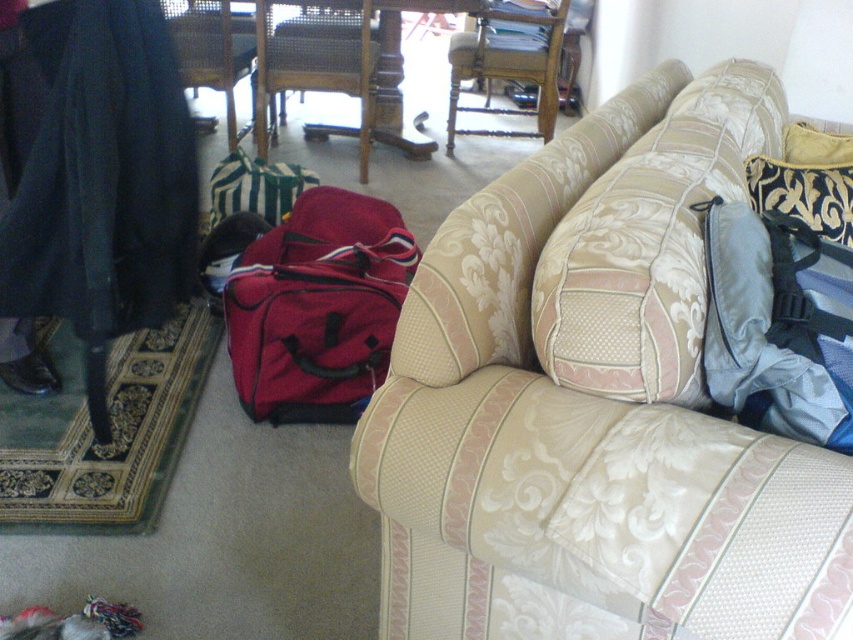
Question: Which point appears farthest from the camera in this image?

Choices:
 (A) coord(831,150)
 (B) coord(840,275)
 (C) coord(267,179)

Answer: (C)

Question: Does matte red duffel at center have a greater width compared to wooden woven armchair at center?

Choices:
 (A) yes
 (B) no

Answer: (B)

Question: Can you confirm if green striped fabric bag at center-left is bigger than velvet gold pillow at right?

Choices:
 (A) yes
 (B) no

Answer: (A)

Question: Which point is closer to the camera?

Choices:
 (A) beige fabric couch at right
 (B) blue fabric bag at right
 (C) matte red duffel at center

Answer: (A)

Question: Does wooden armchair at center have a lesser width compared to black velvet pillow at upper right?

Choices:
 (A) no
 (B) yes

Answer: (A)

Question: Which object is positioned farthest from the rattan armchair at left?

Choices:
 (A) matte red duffel at center
 (B) wooden armchair at center

Answer: (A)